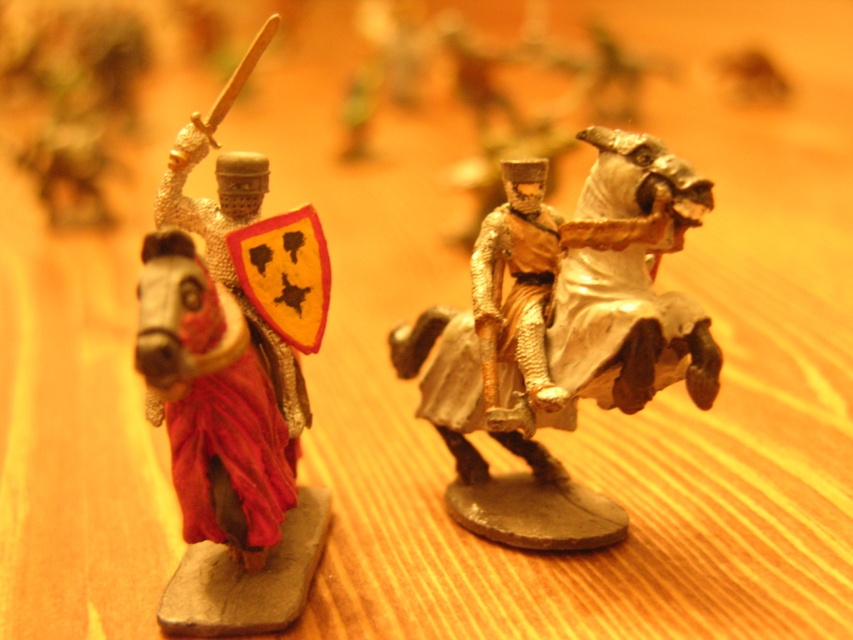
You are a medieval knight trying to cross a narrow bridge. You see the metallic silver horse at left and the gold metallic horse at center. Which horse is closer to the left edge of the bridge?

The metallic silver horse at left is positioned on the left side of gold metallic horse at center, so it is closer to the left edge of the bridge.

You are a medieval knight standing on the wooden surface where the metallic silver horse at left and gold metallic horse at center are displayed. You need to place a small banner between them. Based on their positions, where should you place the banner so it is between both horses?

The metallic silver horse at left is located below the gold metallic horse at center. To place the banner between them, position it horizontally between the two horses, ensuring it is above the metallic silver horse at left and below the gold metallic horse at center.